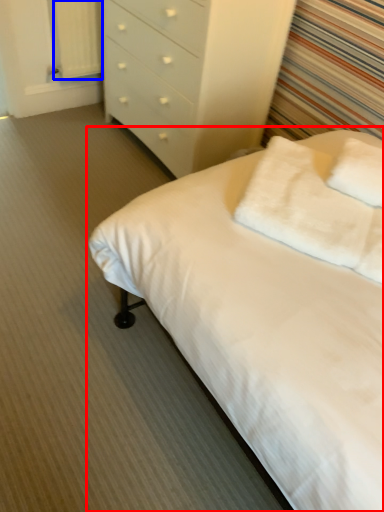
Question: Which object appears farthest to the camera in this image, bed (highlighted by a red box) or curtain (highlighted by a blue box)?

Choices:
 (A) bed
 (B) curtain

Answer: (B)